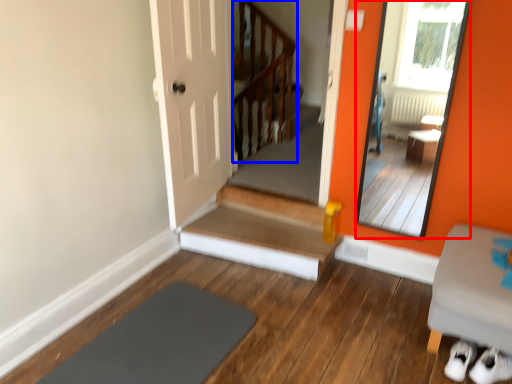
Question: Which object appears farthest to the camera in this image, mirror (highlighted by a red box) or balustrade (highlighted by a blue box)?

Choices:
 (A) mirror
 (B) balustrade

Answer: (B)